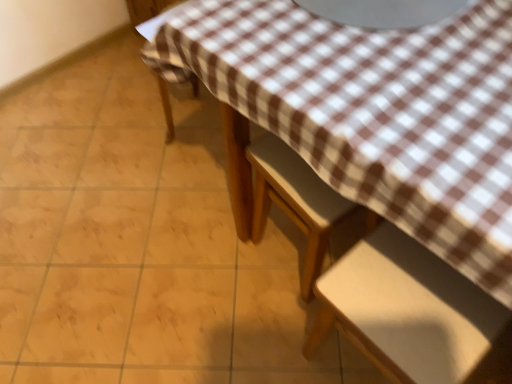
Where is `vacant space that is to the left of wooden chair at center, placed as the second chair when sorted from top to bottom`? The height and width of the screenshot is (384, 512). vacant space that is to the left of wooden chair at center, placed as the second chair when sorted from top to bottom is located at coordinates (228, 265).